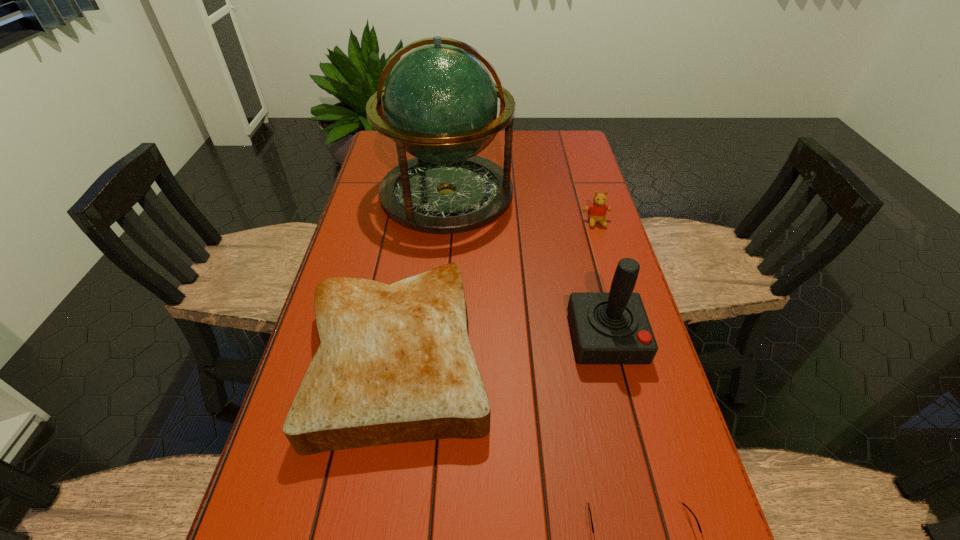
The width and height of the screenshot is (960, 540). Find the location of `globe`. globe is located at coordinates coord(440,103).

Image resolution: width=960 pixels, height=540 pixels. Identify the location of the second tallest object. (608, 328).

Where is `teddy bear`? teddy bear is located at coordinates (596, 211).

Find the location of a particular element. The height and width of the screenshot is (540, 960). the fourth tallest object is located at coordinates (395, 364).

The image size is (960, 540). Identify the location of vacant region located on the front-facing side of the globe. (436, 308).

This screenshot has width=960, height=540. Find the location of `free space located 0.290m on the base of the joystick`. free space located 0.290m on the base of the joystick is located at coordinates (650, 514).

In order to click on free location located on the front-facing side of the teddy bear in this screenshot , I will do `click(602, 242)`.

The width and height of the screenshot is (960, 540). Identify the location of vacant region located 0.140m on the back of the fourth tallest object. (416, 248).

Where is `object that is at the far edge`? object that is at the far edge is located at coordinates (440, 103).

Where is `globe present at the left edge`? The height and width of the screenshot is (540, 960). globe present at the left edge is located at coordinates (440, 103).